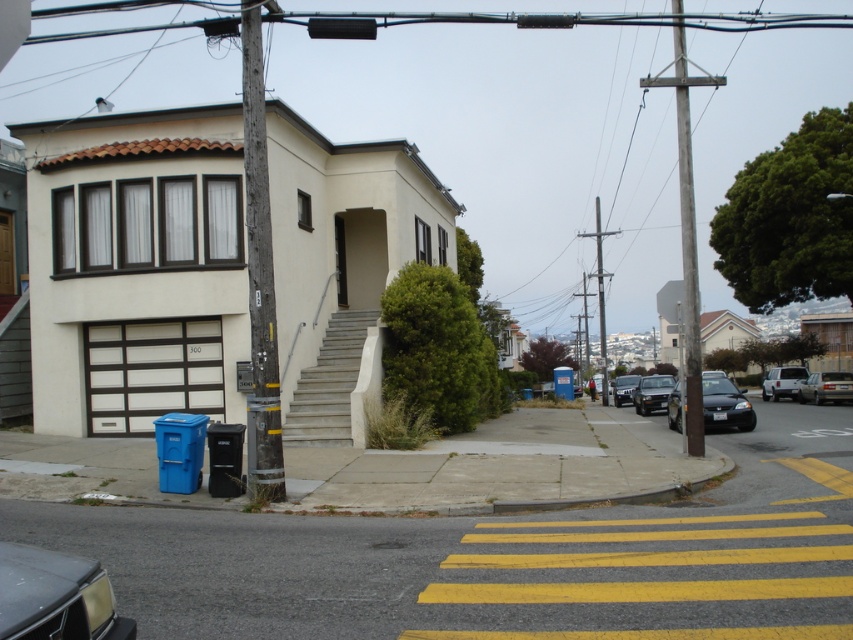
A pedestrian wants to cross the street safely. They are standing at the point marked as point (688, 172). The nearest crosswalk is 14.91 meters away. Is the crosswalk within a safe distance for the pedestrian to reach before the traffic light turns red in 10 seconds? Assume the pedestrian walks at 1.5 m per second.

The pedestrian needs to cover 14.91 meters at 1.5 m per second, which would take approximately 9.94 seconds. Since the traffic light has 10 seconds remaining, the crosswalk is within a safe distance for the pedestrian to reach before the light turns red.